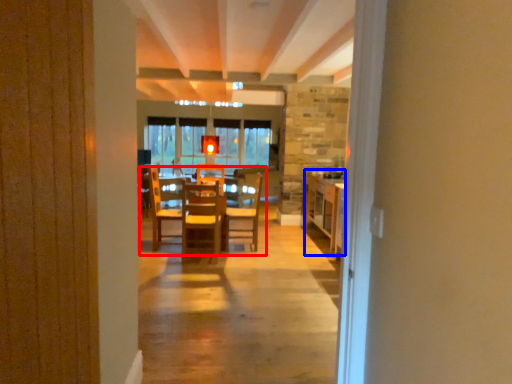
Question: Which object appears closest to the camera in this image, table (highlighted by a red box) or table (highlighted by a blue box)?

Choices:
 (A) table
 (B) table

Answer: (A)